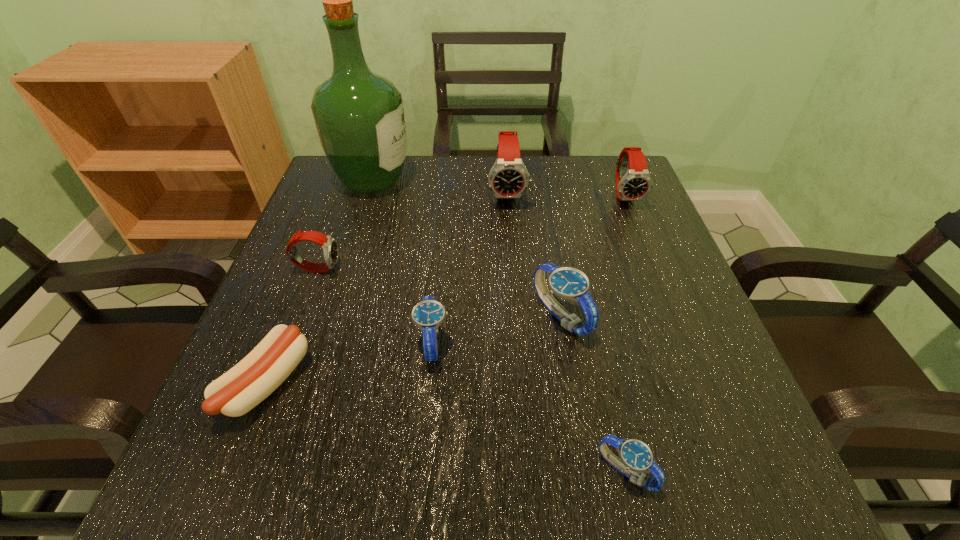
Where is `blank space at the far edge`? The height and width of the screenshot is (540, 960). blank space at the far edge is located at coordinates (431, 186).

Find the location of a particular element. This screenshot has width=960, height=540. vacant space at the near edge is located at coordinates (385, 476).

What are the coordinates of `free space at the right edge of the desktop` in the screenshot? It's located at (629, 269).

In the image, there is a desktop. At what (x,y) coordinates should I click in order to perform the action: click on blank space at the near left corner. Please return your answer as a coordinate pair (x, y). The width and height of the screenshot is (960, 540). Looking at the image, I should click on (242, 484).

I want to click on vacant space at the far right corner, so click(577, 159).

Locate an element on the screen. vacant area that lies between the sausage and the rightmost object is located at coordinates coord(446,289).

You are a GUI agent. You are given a task and a screenshot of the screen. Output one action in this format:
    pyautogui.click(x=<x>, y=<y>)
    Task: Click on the unoccupied position between the sausage and the second red watch from right to left
    
    Given the screenshot: What is the action you would take?
    pyautogui.click(x=387, y=287)

Locate an element on the screen. The height and width of the screenshot is (540, 960). free point between the tallest object and the second biggest blue watch is located at coordinates (402, 260).

Find the location of a particular element. Image resolution: width=960 pixels, height=540 pixels. empty space between the biggest blue watch and the sausage is located at coordinates (414, 349).

Identify the location of free area in between the leftmost blue watch and the sausage. This screenshot has height=540, width=960. (349, 362).